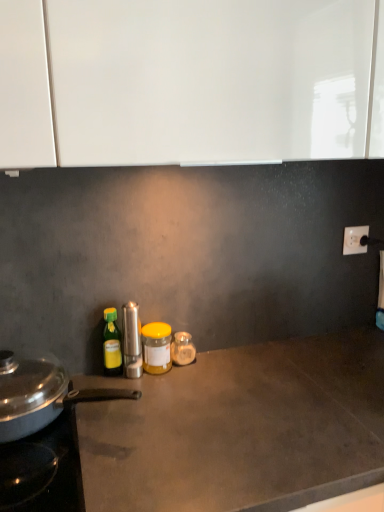
Where is `vacant area that is situated to the right of translucent glass jar at center, arranged as the third bottle when viewed from the left`? This screenshot has width=384, height=512. vacant area that is situated to the right of translucent glass jar at center, arranged as the third bottle when viewed from the left is located at coordinates (237, 367).